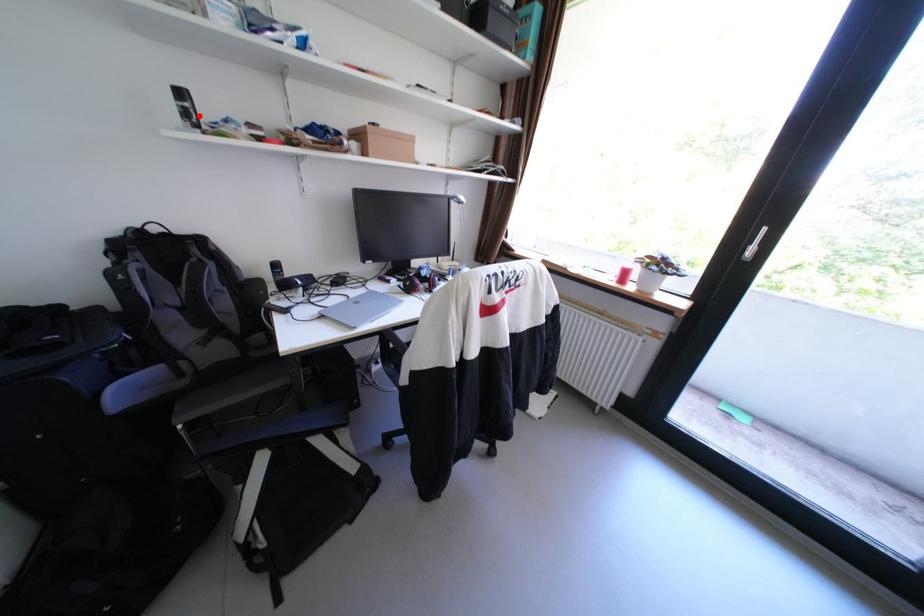
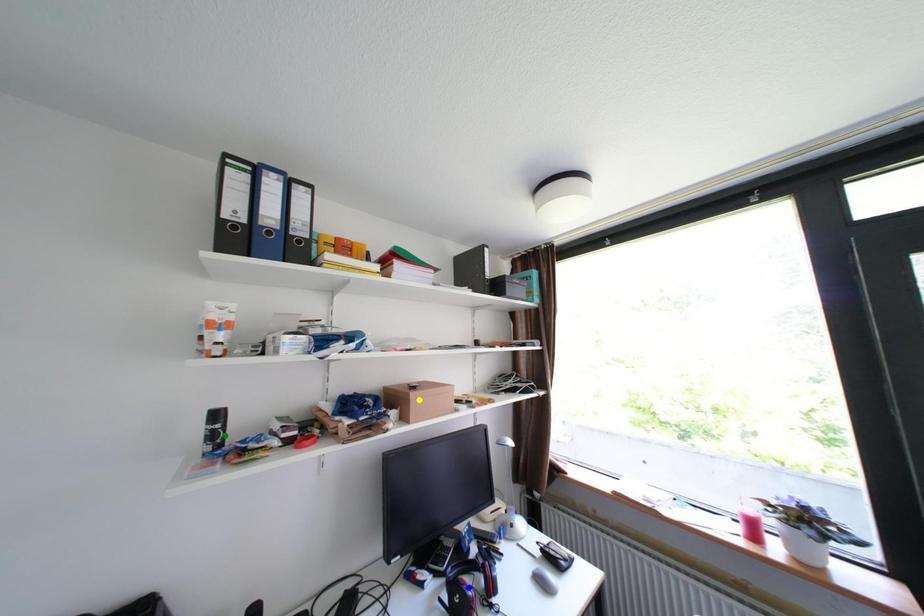
Question: I am providing you with two images of the same scene from different viewpoints. A red point is marked on the first image. You are given multiple points on the second image. Can you choose the point in image 2 that corresponds to the point in image 1?

Choices:
 (A) yellow point
 (B) green point
 (C) blue point

Answer: (B)